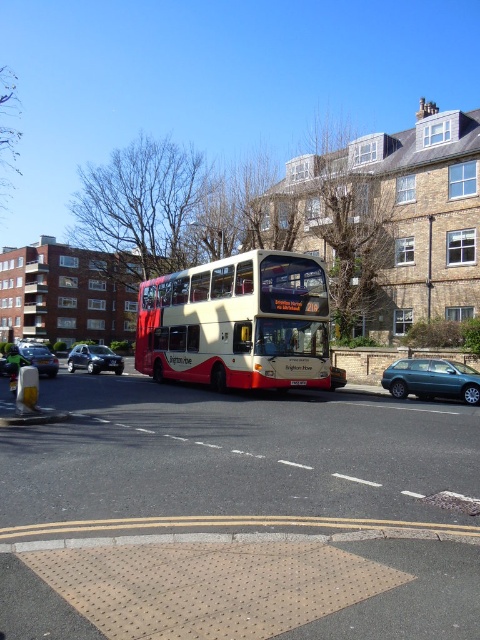
Question: Is metallic teal hatchback at center right wider than metallic silver hatchback at lower left?

Choices:
 (A) no
 (B) yes

Answer: (A)

Question: Considering the relative positions of white matte double-decker bus at center and metallic teal hatchback at center right in the image provided, where is white matte double-decker bus at center located with respect to metallic teal hatchback at center right?

Choices:
 (A) below
 (B) above

Answer: (B)

Question: Which of the following is the closest to the observer?

Choices:
 (A) metallic silver hatchback at lower left
 (B) white matte double-decker bus at center
 (C) shiny black sedan at left
 (D) black plastic license plate at center

Answer: (B)

Question: Which object appears closest to the camera in this image?

Choices:
 (A) shiny black sedan at left
 (B) metallic silver hatchback at lower left

Answer: (A)

Question: Can you confirm if metallic silver hatchback at lower left is wider than shiny black sedan at left?

Choices:
 (A) no
 (B) yes

Answer: (A)

Question: Which of these objects is positioned closest to the black plastic license plate at center?

Choices:
 (A) metallic teal hatchback at center right
 (B) shiny black sedan at left
 (C) metallic silver hatchback at lower left

Answer: (A)